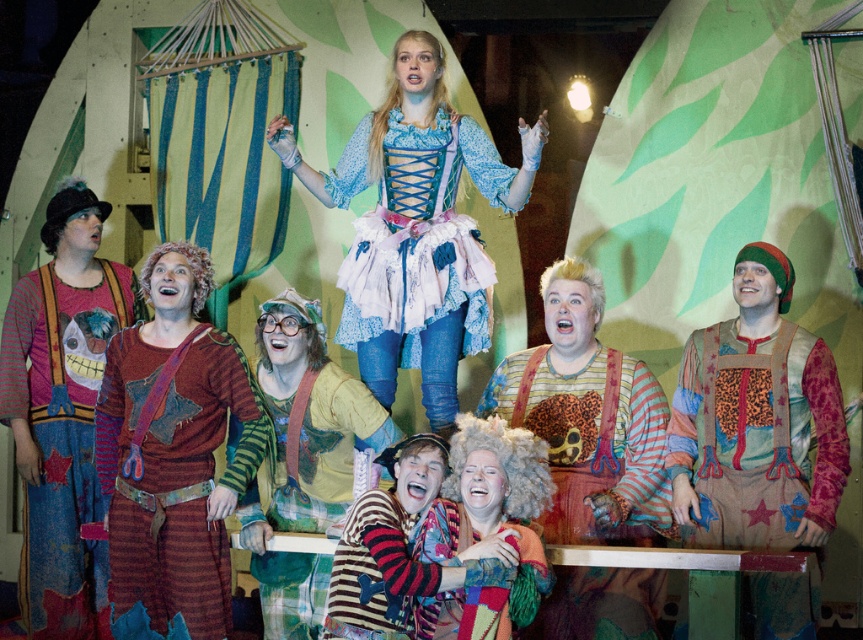
You are a costume designer preparing for a play. You have two outfits to place on a mannequin display. The first is the distressed denim outfit at left, and the second is the knitted sweater at center. If the mannequin can only fit one outfit, which one should you choose based on their sizes?

The distressed denim outfit at left is bigger than the knitted sweater at center, so you should choose the distressed denim outfit at left for the mannequin display.

You are a stagehand who needs to place a spotlight on the stage. The spotlight can only illuminate one of the two points, either the point at coordinates point (652, 480) or point (82, 497). Which point should you choose to ensure the light reaches the performer closer to the audience?

Point (652, 480) is in front of point (82, 497), so the spotlight should be placed on point (652, 480) to illuminate the performer closer to the audience.